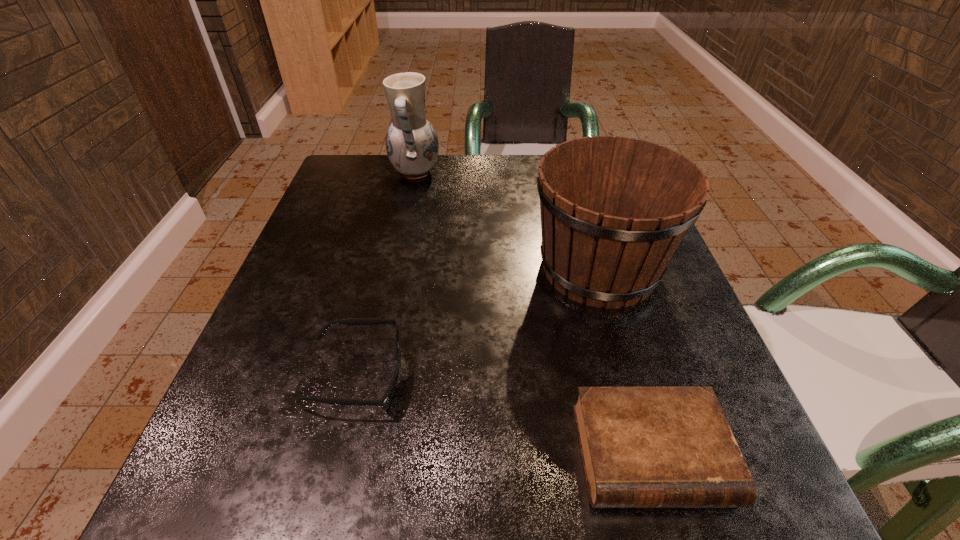
Locate an element on the screen. Image resolution: width=960 pixels, height=540 pixels. pottery is located at coordinates (412, 146).

At what (x,y) coordinates should I click in order to perform the action: click on the third nearest object. Please return your answer as a coordinate pair (x, y). Looking at the image, I should click on (614, 210).

Identify the location of sunglasses. This screenshot has width=960, height=540. (386, 399).

This screenshot has height=540, width=960. I want to click on diary, so click(642, 447).

Locate an element on the screen. Image resolution: width=960 pixels, height=540 pixels. free space located 0.300m on either side of the pottery is located at coordinates (564, 173).

Where is `vacant space situated 0.280m on the front of the third nearest object`? This screenshot has height=540, width=960. vacant space situated 0.280m on the front of the third nearest object is located at coordinates (668, 501).

I want to click on vacant space located on the front-facing side of the sunglasses, so 515,376.

Identify the location of object present at the far edge. (412, 146).

Locate an element on the screen. This screenshot has width=960, height=540. object positioned at the near edge is located at coordinates (642, 447).

Where is `pottery present at the left edge`? pottery present at the left edge is located at coordinates tap(412, 146).